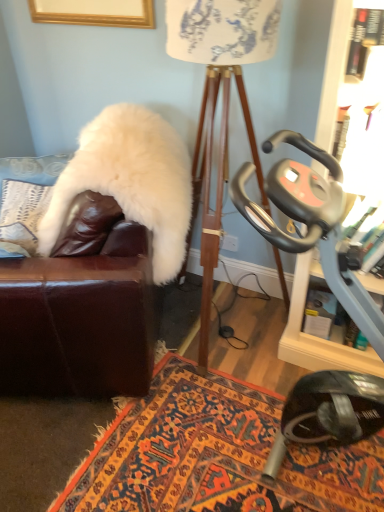
Image resolution: width=384 pixels, height=512 pixels. I want to click on free space in front of white fabric lampshade at center, so click(x=185, y=420).